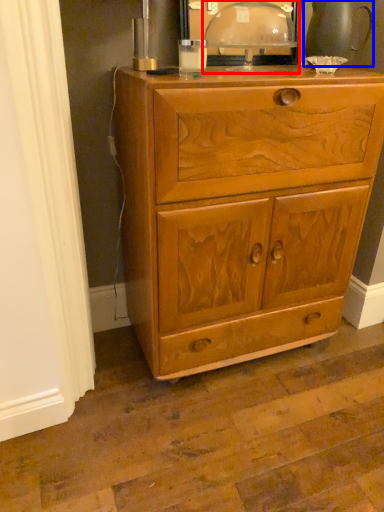
Question: Which point is closer to the camera, table lamp (highlighted by a red box) or tea pot (highlighted by a blue box)?

Choices:
 (A) table lamp
 (B) tea pot

Answer: (A)